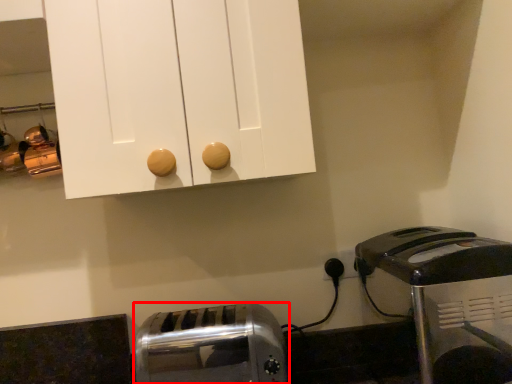
Question: From the image's perspective, considering the relative positions of toaster (annotated by the red box) and toaster in the image provided, where is toaster (annotated by the red box) located with respect to the staircase?

Choices:
 (A) above
 (B) below

Answer: (B)